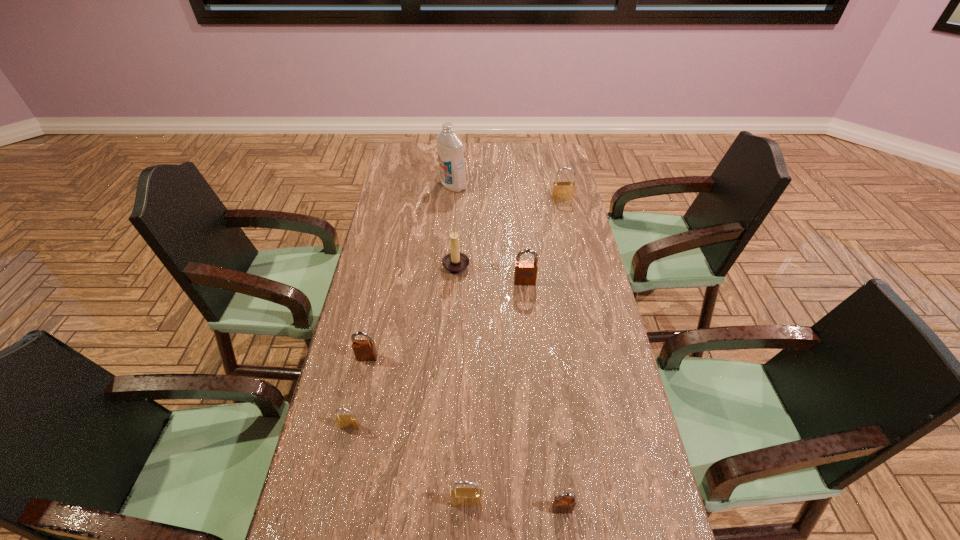
I want to click on brass padlock that is the closest to the fifth nearest object, so click(561, 190).

This screenshot has width=960, height=540. Find the location of `brown padlock object that ranks as the second closest to the second biggest brass padlock`. brown padlock object that ranks as the second closest to the second biggest brass padlock is located at coordinates (364, 350).

Locate an element on the screen. The width and height of the screenshot is (960, 540). the second closest brown padlock to the second smallest brown padlock is located at coordinates [x=564, y=503].

You are a GUI agent. You are given a task and a screenshot of the screen. Output one action in this format:
    pyautogui.click(x=<x>, y=<y>)
    Task: Click on the vacant area in the image that satisfies the following two spatial constraints: 1. on the front-facing side of the rightmost padlock; 2. on the wick of the brown candle holder
    The height and width of the screenshot is (540, 960).
    Given the screenshot: What is the action you would take?
    pyautogui.click(x=577, y=265)